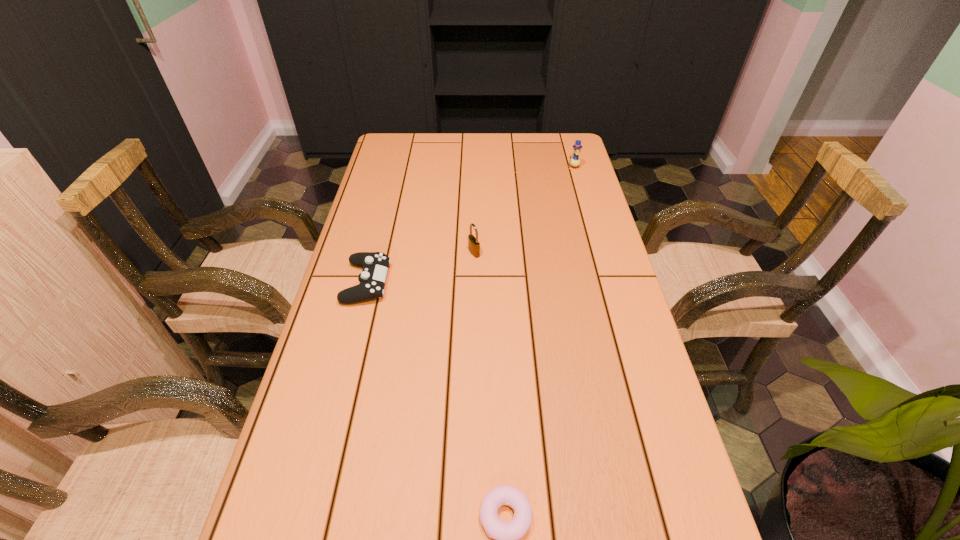
At what (x,y) coordinates should I click in order to perform the action: click on object that can be found as the closest to the leftmost object. Please return your answer as a coordinate pair (x, y). The image size is (960, 540). Looking at the image, I should click on (473, 244).

You are a GUI agent. You are given a task and a screenshot of the screen. Output one action in this format:
    pyautogui.click(x=<x>, y=<y>)
    Task: Click on the vacant region that satisfies the following two spatial constraints: 1. on the face of the duckling, where the monocle is placed; 2. on the surface of the control
    The height and width of the screenshot is (540, 960).
    Given the screenshot: What is the action you would take?
    pyautogui.click(x=606, y=282)

What are the coordinates of `vacant position in the image that satisfies the following two spatial constraints: 1. on the face of the duckling, where the monocle is placed; 2. on the surface of the leftmost object` in the screenshot? It's located at (606, 282).

The height and width of the screenshot is (540, 960). I want to click on vacant region that satisfies the following two spatial constraints: 1. on the front side of the third nearest object; 2. on the surface of the control, so click(473, 282).